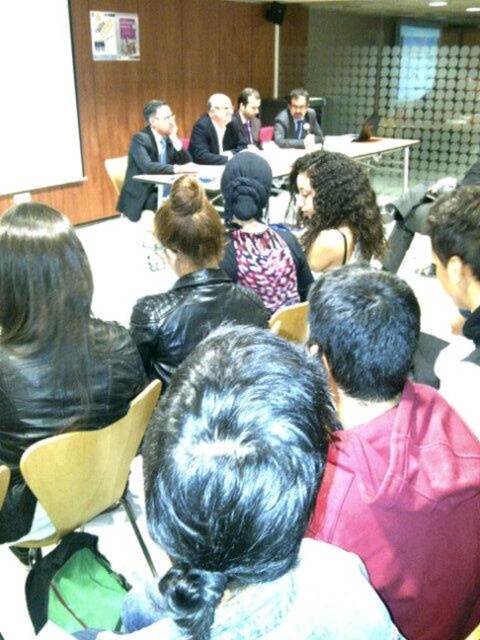
You are a photographer standing at the back of the room. You want to take a photo of the dark suit jacket at center and the matte black suit at center. The minimum distance your camera can focus clearly on two objects is 80 centimeters. Will both suits be in focus?

The dark suit jacket at center is 77.49 centimeters away from matte black suit at center. Since the distance between them is less than the camera minimum focusing distance of 80 centimeters, both suits will be in focus.

You are an attendee at the meeting and want to hand a document to the person wearing the dark suit jacket at center and the matte black suit at center. Which one can you reach first without moving from your seat?

The dark suit jacket at center is closer to the viewer than the matte black suit at center, so you can reach the person wearing the dark suit jacket at center first without moving from your seat.

You are an attendee at the presentation and need to identify the speaker wearing a dark suit jacket at center and the one in matte black suit at center. Which speaker is positioned to the left?

The dark suit jacket at center is to the left of matte black suit at center, so the speaker wearing the dark suit jacket at center is positioned to the left.